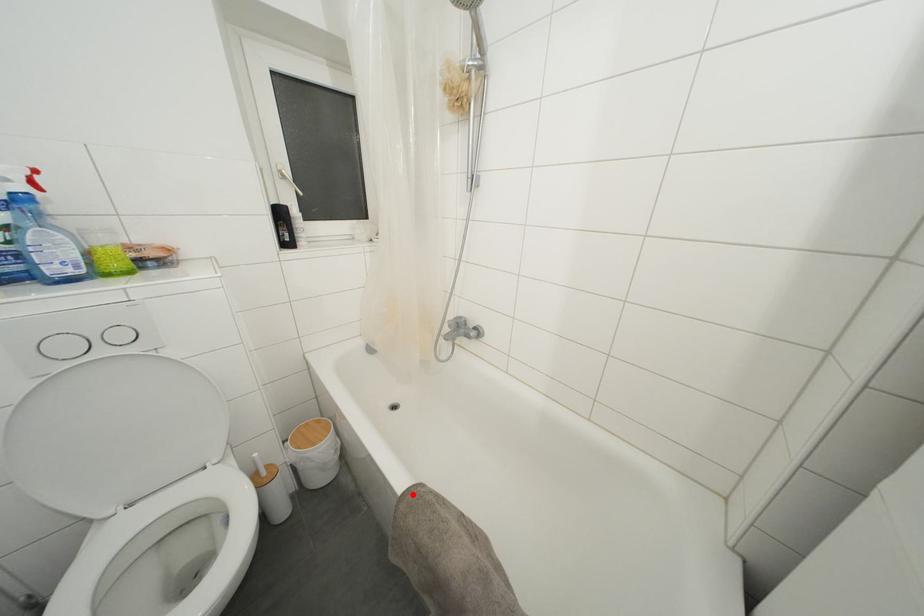
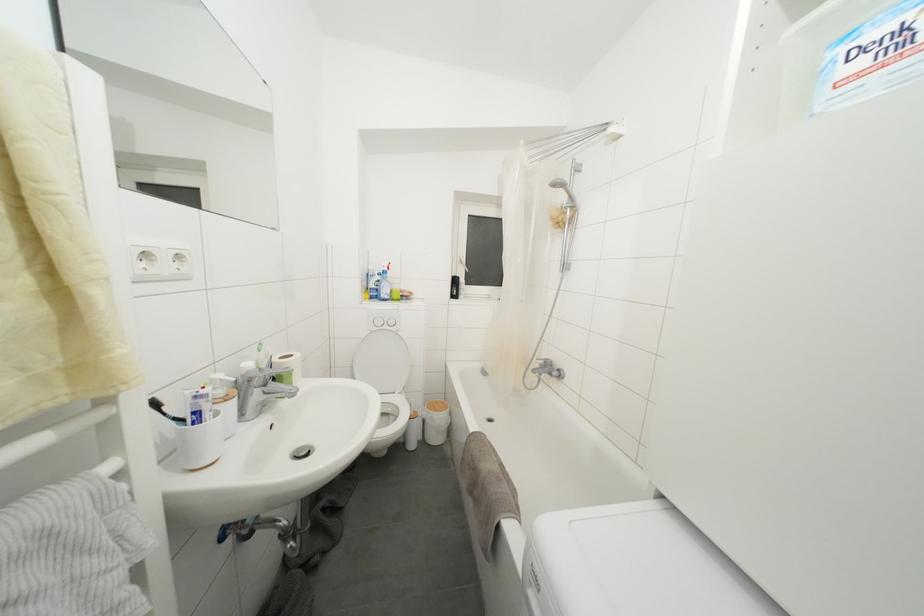
The point at the highlighted location is marked in the first image. Where is the corresponding point in the second image?

(480, 438)